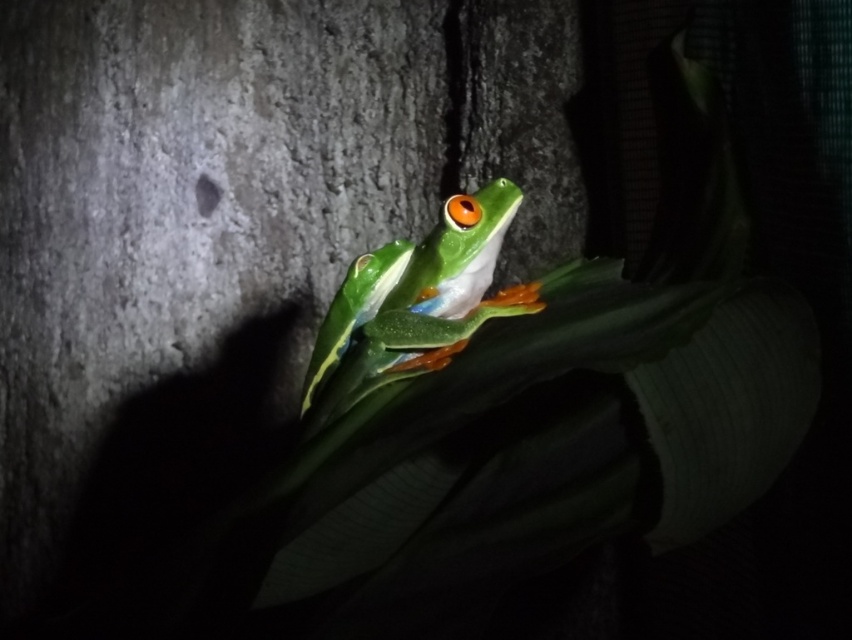
Question: Is rough bark tree trunk at center to the right of green matte tree frog at center from the viewer's perspective?

Choices:
 (A) no
 (B) yes

Answer: (A)

Question: Is rough bark tree trunk at center to the right of green matte tree frog at center from the viewer's perspective?

Choices:
 (A) no
 (B) yes

Answer: (A)

Question: Which object appears closest to the camera in this image?

Choices:
 (A) rough bark tree trunk at center
 (B) green matte tree frog at center

Answer: (B)

Question: Where is rough bark tree trunk at center located in relation to green matte tree frog at center in the image?

Choices:
 (A) right
 (B) left

Answer: (B)